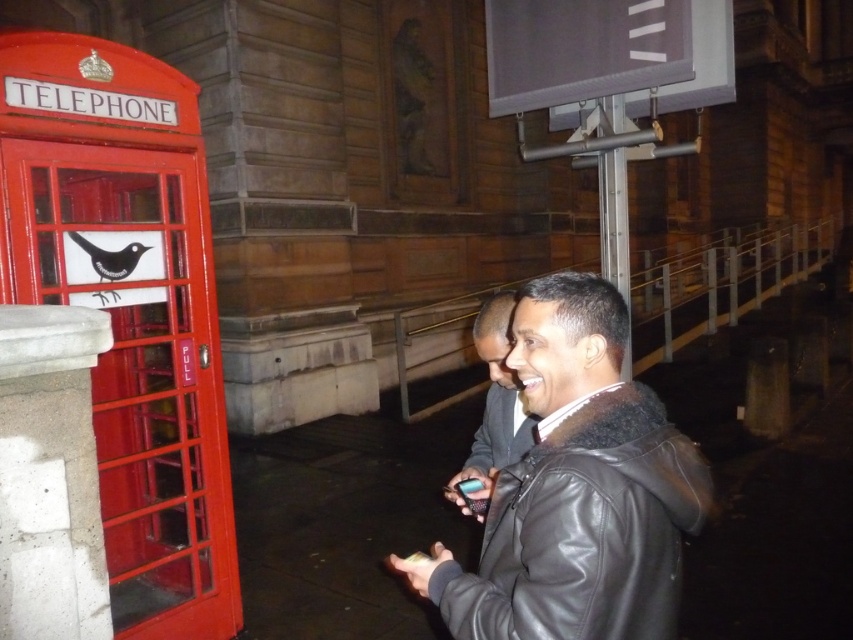
Is point (480, 586) more distant than point (503, 353)?

That is False.

Is point (639, 568) closer to viewer compared to point (521, 397)?

That is True.

Where is `black leather jacket at center`? Image resolution: width=853 pixels, height=640 pixels. black leather jacket at center is located at coordinates (576, 490).

Locate an element on the screen. This screenshot has height=640, width=853. black leather jacket at center is located at coordinates (576, 490).